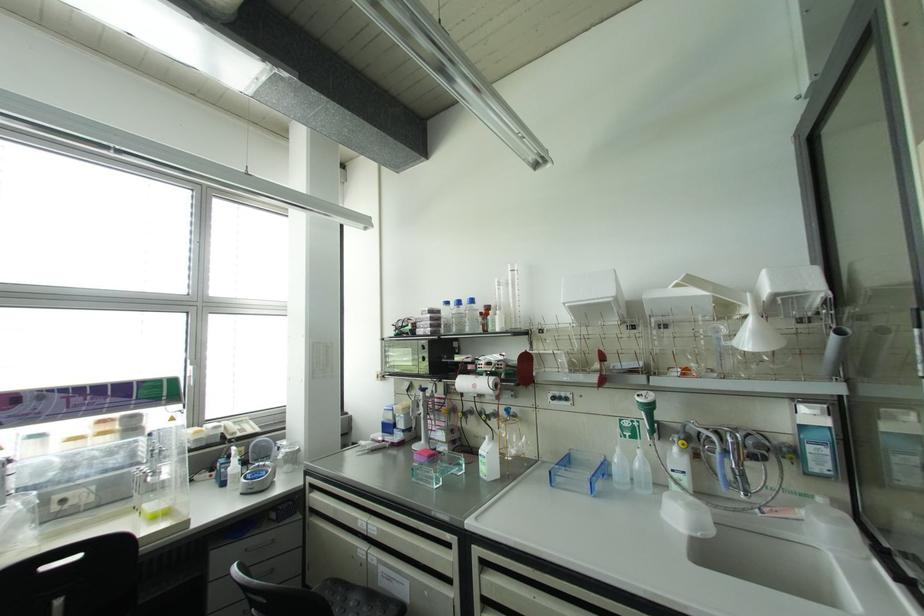
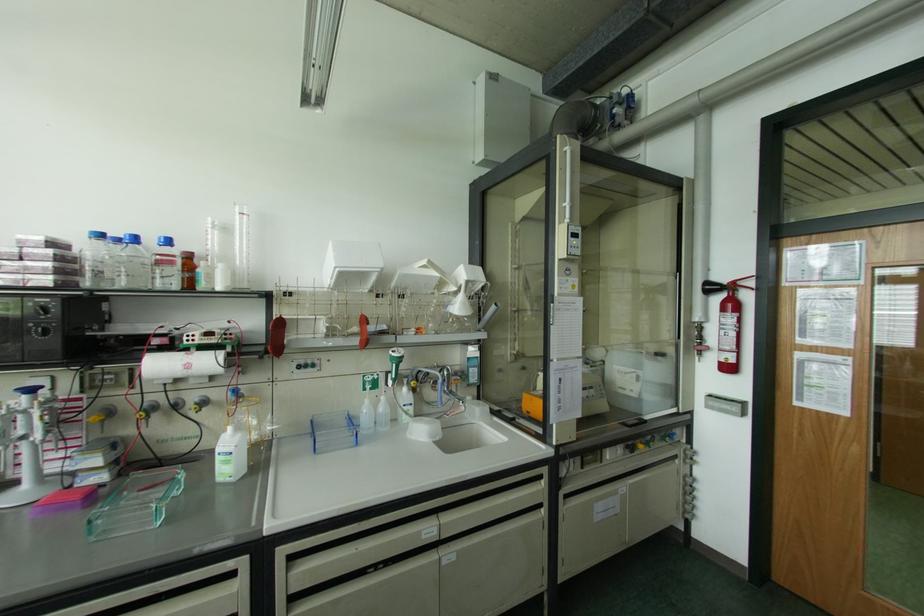
Where in the second image is the point corresponding to the point at 458,302 from the first image?

(134, 238)